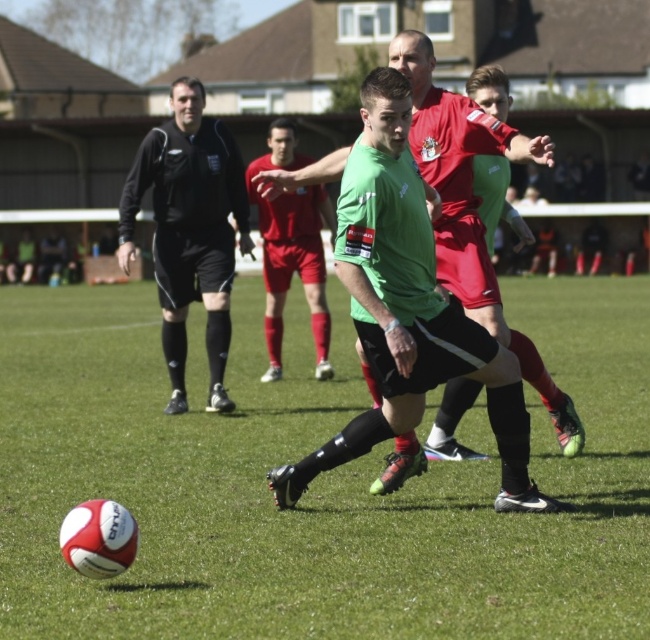
You are a soccer coach analyzing the game. The field has a penalty area starting at point 0.5, 0.6. Is the player in the green matte jersey at center inside the penalty area?

The green matte jersey at center is located at point [408,308]. The penalty area starts at [390,320]. Since the player is at 0.483 which is less than 0.5 on the x coordinate, the player is outside the penalty area.

You are a soccer referee positioned at the center of the field. You see the white textured ball at lower left. According to FIFA regulations, the ball must be at least 2 meters away from the nearest player during a free kick. Is the ball positioned correctly for a free kick scenario?

The white textured ball at lower left is 5.43 meters away from the viewer, which is more than the required 2 meters, so it is positioned correctly for a free kick scenario.

You are a soccer coach analyzing the players on the field. You notice the green matte jersey at center and the black smooth shirt at upper left. Which player is wearing a larger sized jersey?

The green matte jersey at center has a larger size compared to the black smooth shirt at upper left, so the player wearing the green matte jersey at center has the larger sized jersey.